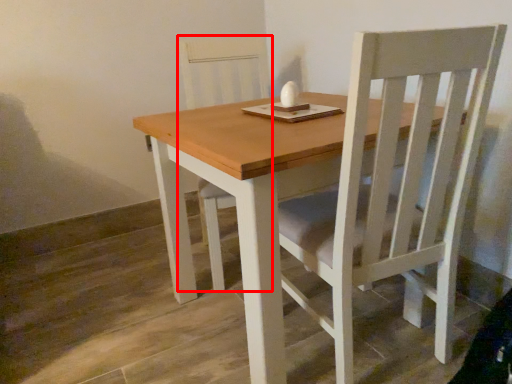
Question: From the image's perspective, where is chair (annotated by the red box) located relative to round table?

Choices:
 (A) below
 (B) above

Answer: (B)